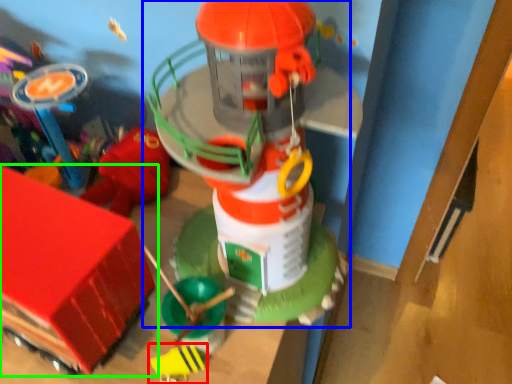
Question: Estimate the real-world distances between objects in this image. Which object is closer to toy (highlighted by a red box), toy (highlighted by a blue box) or toy (highlighted by a green box)?

Choices:
 (A) toy
 (B) toy

Answer: (B)